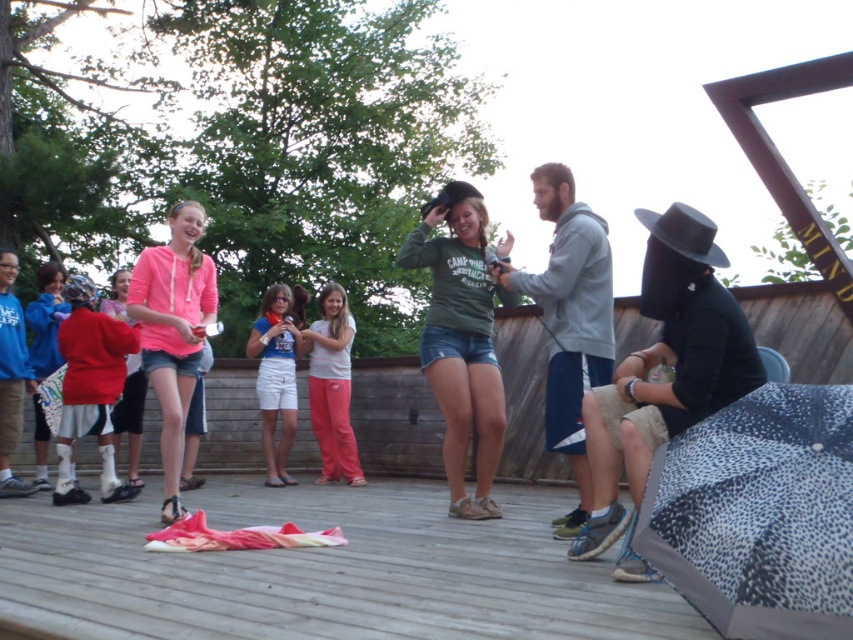
Based on the photo, does pink cotton hoodie at center have a lesser height compared to black felt cowboy hat at upper right?

No.

Can you confirm if pink cotton hoodie at center is taller than black felt cowboy hat at upper right?

Indeed, pink cotton hoodie at center has a greater height compared to black felt cowboy hat at upper right.

Who is more distant from viewer, (192,328) or (664,225)?

Result: Positioned behind is point (192,328).

Where is `pink cotton hoodie at center`? Image resolution: width=853 pixels, height=640 pixels. pink cotton hoodie at center is located at coordinates (173, 332).

Find the location of `green matte sweatshirt at center`. green matte sweatshirt at center is located at coordinates (461, 340).

Does green matte sweatshirt at center have a lesser height compared to pink cotton hoodie at center?

In fact, green matte sweatshirt at center may be taller than pink cotton hoodie at center.

This screenshot has height=640, width=853. What do you see at coordinates (461, 340) in the screenshot?
I see `green matte sweatshirt at center` at bounding box center [461, 340].

This screenshot has width=853, height=640. In order to click on green matte sweatshirt at center in this screenshot , I will do `click(461, 340)`.

Find the location of a particular element. The width and height of the screenshot is (853, 640). wooden deck at center is located at coordinates (321, 572).

This screenshot has height=640, width=853. What do you see at coordinates (321, 572) in the screenshot?
I see `wooden deck at center` at bounding box center [321, 572].

The height and width of the screenshot is (640, 853). What are the coordinates of `wooden deck at center` in the screenshot? It's located at (321, 572).